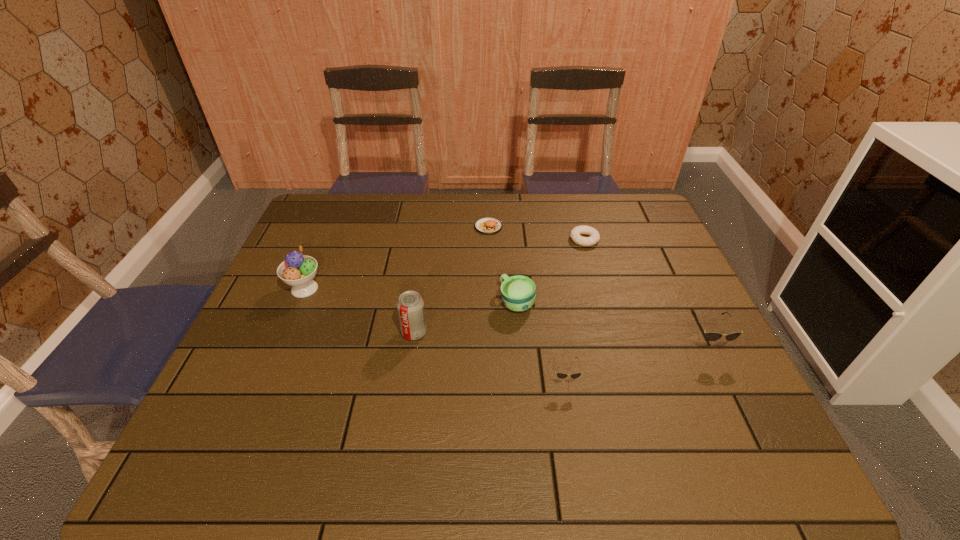
The sunglassess are evenly distributed in the image. To maintain this, where would you place another sunglasses on the left? Please point to a free space. Please provide its 2D coordinates. Your answer should be formatted as a tuple, i.e. [(x, y)], where the tuple contains the x and y coordinates of a point satisfying the conditions above.

[(398, 420)]